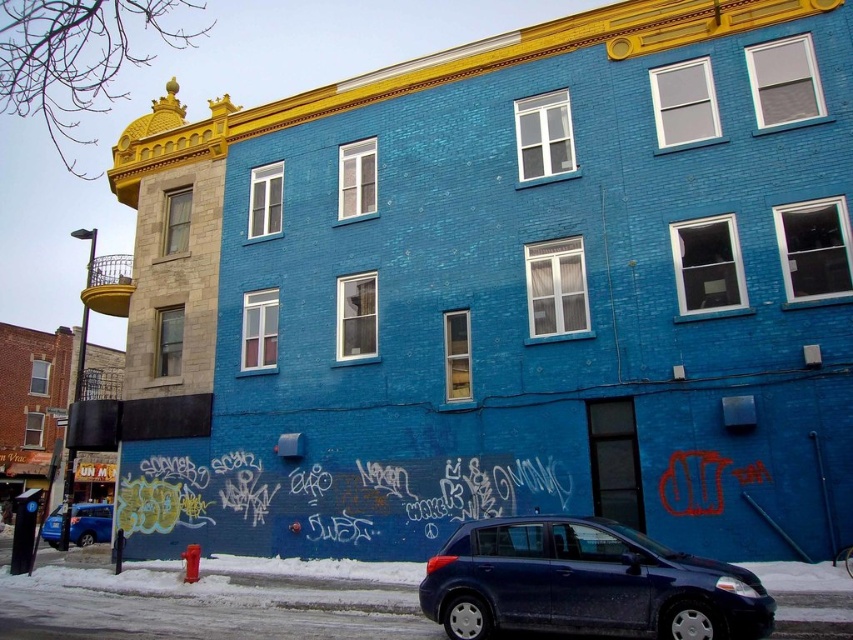
You are a delivery person who needs to park your van between the satin blue hatchback at lower center and the matte blue sedan at lower left. The van is 20 feet long. Can you fit it in the space between them?

The distance between the satin blue hatchback at lower center and the matte blue sedan at lower left is 63.39 feet. Since the van is only 20 feet long, there is more than enough space to park it between them.

You are a delivery person trying to access the entrance of the building. The entrance is located at the lower part of the building, which is partially blocked by the satin blue hatchback at lower center and the matte blue sedan at lower left. Which car do you need to move to gain access to the entrance?

The satin blue hatchback at lower center is positioned over matte blue sedan at lower left, so you need to move the satin blue hatchback at lower center first to access the entrance.